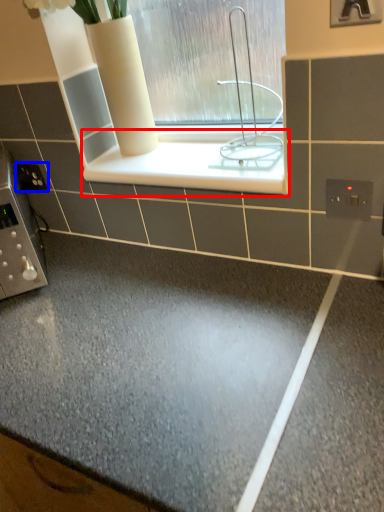
Question: Which of the following is the farthest to the observer, ledge (highlighted by a red box) or electric outlet (highlighted by a blue box)?

Choices:
 (A) ledge
 (B) electric outlet

Answer: (B)